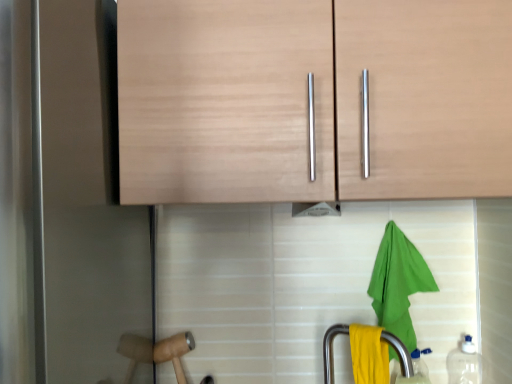
You are a GUI agent. You are given a task and a screenshot of the screen. Output one action in this format:
    pyautogui.click(x=<x>, y=<y>)
    Task: Click on the green fabric towel at lower right
    
    Given the screenshot: What is the action you would take?
    pyautogui.click(x=398, y=283)

In order to face green fabric towel at lower right, should I rotate leftwards or rightwards?

Turn right by 19.484 degrees to look at green fabric towel at lower right.

Describe the element at coordinates (320, 98) in the screenshot. I see `light wood cabinet at upper center` at that location.

In order to face yellow matte towel at lower center, should I rotate leftwards or rightwards?

To face it directly, rotate right by 14.830 degrees.

Identify the location of green fabric towel at lower right. (398, 283).

This screenshot has width=512, height=384. In order to click on bottle that is the 2nd object to the right of the light wood cabinet at upper center, starting at the anchor in this screenshot , I will do `click(464, 363)`.

From the image's perspective, is transparent plastic bottle at lower right, which is the 1th bottle in right-to-left order, located beneath light wood cabinet at upper center?

Yes, from the image's perspective, transparent plastic bottle at lower right, which is the 1th bottle in right-to-left order, is beneath light wood cabinet at upper center.

Could you tell me if transparent plastic bottle at lower right, which is the 1th bottle in right-to-left order, is facing light wood cabinet at upper center?

No, transparent plastic bottle at lower right, which is the 1th bottle in right-to-left order, does not turn towards light wood cabinet at upper center.

Considering the relative sizes of light wood cabinet at upper center and yellow matte towel at lower center in the image provided, is light wood cabinet at upper center shorter than yellow matte towel at lower center?

No.

From a real-world perspective, which object rests below the other?

yellow matte towel at lower center.

From the image's perspective, which is below, light wood cabinet at upper center or yellow matte towel at lower center?

yellow matte towel at lower center appears lower in the image.

Does point (387, 70) lie in front of point (406, 352)?

Yes, it is in front of point (406, 352).

The height and width of the screenshot is (384, 512). I want to click on faucet lying below the light wood cabinet at upper center (from the image's perspective), so click(x=331, y=350).

Is yellow matte towel at lower center far from light wood cabinet at upper center?

yellow matte towel at lower center is near light wood cabinet at upper center, not far away.

Is yellow matte towel at lower center wider or thinner than light wood cabinet at upper center?

Considering their sizes, yellow matte towel at lower center looks slimmer than light wood cabinet at upper center.

Is green fabric towel at lower right not within transparent plastic bottle at lower right, which is the 1th bottle in right-to-left order?

That's correct, green fabric towel at lower right is outside of transparent plastic bottle at lower right, which is the 1th bottle in right-to-left order.

From the image's perspective, between green fabric towel at lower right and transparent plastic bottle at lower right, the 2th bottle viewed from the left, which one is located above?

green fabric towel at lower right is shown above in the image.

Is point (407, 302) more distant than point (464, 341)?

No, (407, 302) is closer to viewer.

This screenshot has height=384, width=512. Find the location of `the 2nd bottle counting from the right side of the green fabric towel at lower right`. the 2nd bottle counting from the right side of the green fabric towel at lower right is located at coordinates (464, 363).

From a real-world perspective, which object rests below the other?

green fabric towel at lower right, from a real-world perspective.

In order to click on beach towel behind the light wood cabinet at upper center in this screenshot , I will do `click(398, 283)`.

Which is behind, light wood cabinet at upper center or green fabric towel at lower right?

green fabric towel at lower right is behind.

Is point (177, 74) positioned behind point (384, 243)?

No, it is not.

Considering the sizes of objects light wood cabinet at upper center and transparent plastic bottle at lower right, which is the 1th bottle in right-to-left order, in the image provided, who is thinner, light wood cabinet at upper center or transparent plastic bottle at lower right, which is the 1th bottle in right-to-left order,?

With smaller width is transparent plastic bottle at lower right, which is the 1th bottle in right-to-left order.

Based on the photo, is light wood cabinet at upper center looking in the opposite direction of transparent plastic bottle at lower right, the 2th bottle viewed from the left?

light wood cabinet at upper center is not turned away from transparent plastic bottle at lower right, the 2th bottle viewed from the left.

Can you confirm if light wood cabinet at upper center is positioned to the right of transparent plastic bottle at lower right, the 2th bottle viewed from the left?

Incorrect, light wood cabinet at upper center is not on the right side of transparent plastic bottle at lower right, the 2th bottle viewed from the left.

Can you confirm if light wood cabinet at upper center is taller than transparent plastic bottle at lower right, which is the 1th bottle in right-to-left order?

Yes, light wood cabinet at upper center is taller than transparent plastic bottle at lower right, which is the 1th bottle in right-to-left order.

From the image's perspective, between transparent plastic bottle at lower right, the 1th bottle in the left-to-right sequence, and yellow matte towel at lower center, who is located below?

From the image's view, transparent plastic bottle at lower right, the 1th bottle in the left-to-right sequence, is below.

Considering the sizes of objects transparent plastic bottle at lower right, marked as the 2th bottle in a right-to-left arrangement, and yellow matte towel at lower center in the image provided, who is wider, transparent plastic bottle at lower right, marked as the 2th bottle in a right-to-left arrangement, or yellow matte towel at lower center?

transparent plastic bottle at lower right, marked as the 2th bottle in a right-to-left arrangement, is wider.

Is there a large distance between transparent plastic bottle at lower right, marked as the 2th bottle in a right-to-left arrangement, and yellow matte towel at lower center?

Actually, transparent plastic bottle at lower right, marked as the 2th bottle in a right-to-left arrangement, and yellow matte towel at lower center are a little close together.

In the scene shown: From a real-world perspective, relative to yellow matte towel at lower center, is transparent plastic bottle at lower right, the 1th bottle in the left-to-right sequence, vertically above or below?

transparent plastic bottle at lower right, the 1th bottle in the left-to-right sequence, is situated lower than yellow matte towel at lower center in the real world.

From a real-world perspective, count 1st bottles downward from the light wood cabinet at upper center and point to it. Please provide its 2D coordinates.

[(464, 363)]

I want to click on faucet lying behind the light wood cabinet at upper center, so click(331, 350).

From the image, which object appears to be farther from transparent plastic bottle at lower right, the 2th bottle viewed from the left, green fabric towel at lower right or yellow matte towel at lower center?

green fabric towel at lower right.

From the picture: Based on their spatial positions, is yellow matte towel at lower center or light wood cabinet at upper center closer to transparent plastic bottle at lower right, the 1th bottle in the left-to-right sequence?

yellow matte towel at lower center is closer to transparent plastic bottle at lower right, the 1th bottle in the left-to-right sequence.

Which object lies nearer to the anchor point light wood cabinet at upper center, yellow matte towel at lower center or green fabric towel at lower right?

green fabric towel at lower right is closer to light wood cabinet at upper center.

Considering their positions, is transparent plastic bottle at lower right, which is the 1th bottle in right-to-left order, positioned further to transparent plastic bottle at lower right, the 1th bottle in the left-to-right sequence, than wooden hammer at lower left?

The object further to transparent plastic bottle at lower right, the 1th bottle in the left-to-right sequence, is wooden hammer at lower left.

Estimate the real-world distances between objects in this image. Which object is further from wooden hammer at lower left, transparent plastic bottle at lower right, the 1th bottle in the left-to-right sequence, or yellow matte towel at lower center?

transparent plastic bottle at lower right, the 1th bottle in the left-to-right sequence, is positioned further to the anchor wooden hammer at lower left.

Considering their positions, is transparent plastic bottle at lower right, which is the 1th bottle in right-to-left order, positioned further to light wood cabinet at upper center than green fabric towel at lower right?

transparent plastic bottle at lower right, which is the 1th bottle in right-to-left order.

Looking at the image, which one is located further to yellow matte towel at lower center, transparent plastic bottle at lower right, the 1th bottle in the left-to-right sequence, or wooden hammer at lower left?

wooden hammer at lower left is further to yellow matte towel at lower center.

Considering their positions, is wooden hammer at lower left positioned closer to green fabric towel at lower right than light wood cabinet at upper center?

Among the two, light wood cabinet at upper center is located nearer to green fabric towel at lower right.

At what (x,y) coordinates should I click in order to perform the action: click on bottle between wooden hammer at lower left and transparent plastic bottle at lower right, the 2th bottle viewed from the left, in the horizontal direction. Please return your answer as a coordinate pair (x, y). The image size is (512, 384). Looking at the image, I should click on tap(414, 369).

Locate an element on the screen. The height and width of the screenshot is (384, 512). beach towel between light wood cabinet at upper center and wooden hammer at lower left vertically is located at coordinates (398, 283).

Locate an element on the screen. beach towel between wooden hammer at lower left and transparent plastic bottle at lower right, the 2th bottle viewed from the left is located at coordinates pos(398,283).

At what (x,y) coordinates should I click in order to perform the action: click on beach towel between wooden hammer at lower left and transparent plastic bottle at lower right, the 1th bottle in the left-to-right sequence. Please return your answer as a coordinate pair (x, y). This screenshot has height=384, width=512. Looking at the image, I should click on (398, 283).